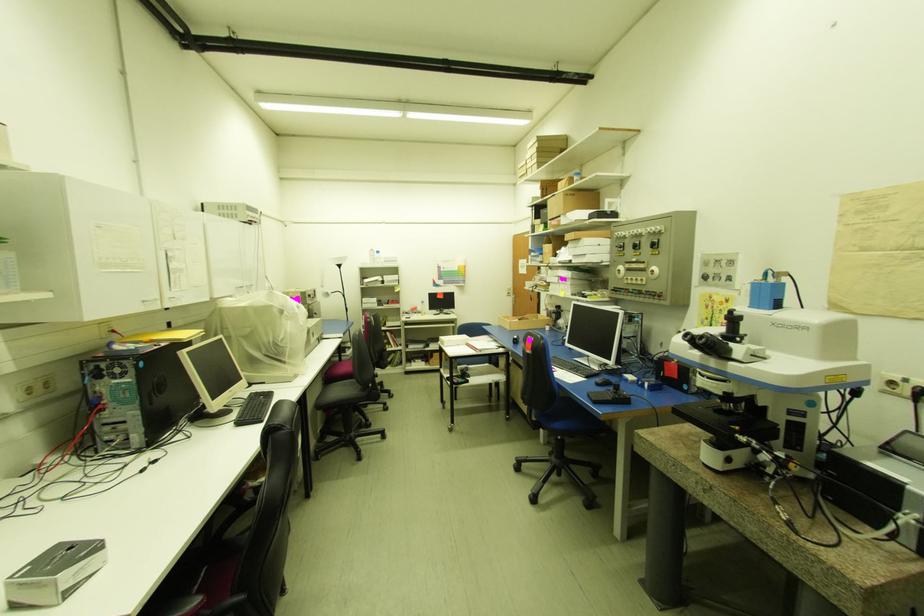
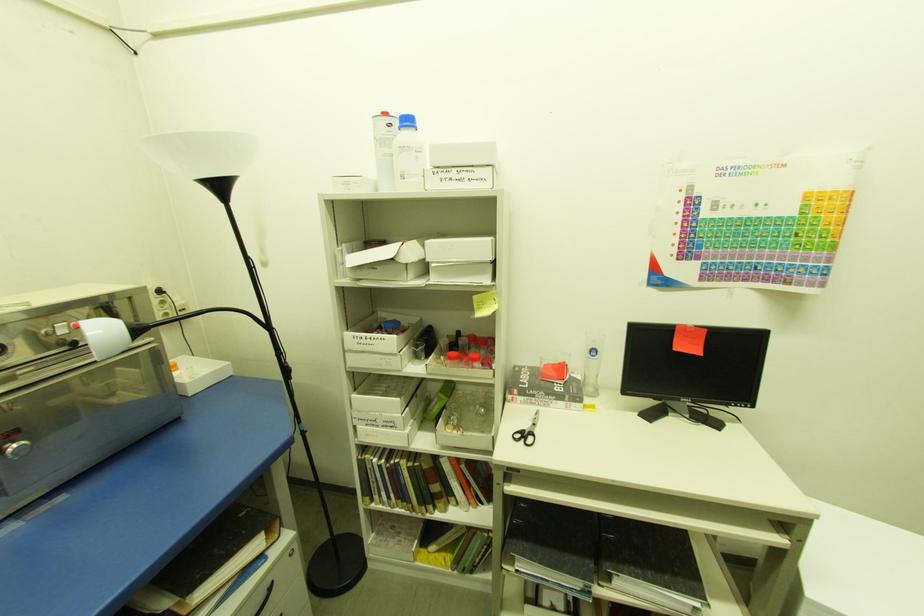
Question: The images are taken continuously from a first-person perspective. In which direction are you moving?

Choices:
 (A) Left
 (B) Right
 (C) Forward
 (D) Backward

Answer: (C)